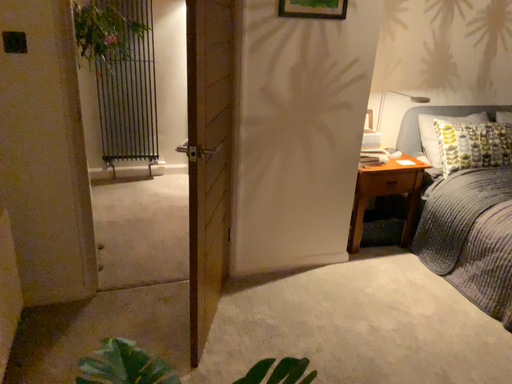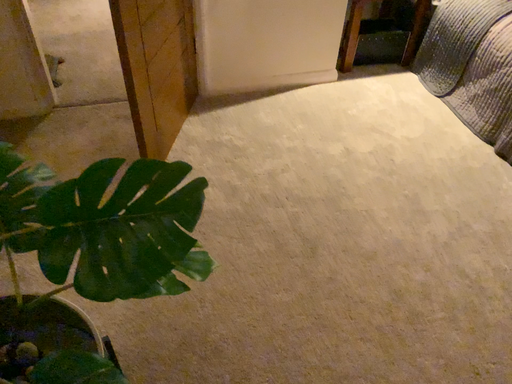
Question: Which way did the camera rotate in the video?

Choices:
 (A) rotated downward
 (B) rotated upward

Answer: (A)